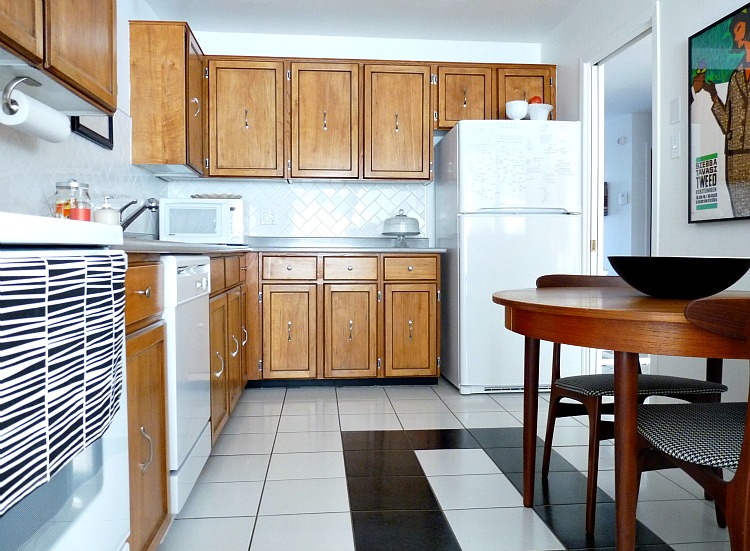
In order to click on kitchen in this screenshot , I will do `click(394, 401)`.